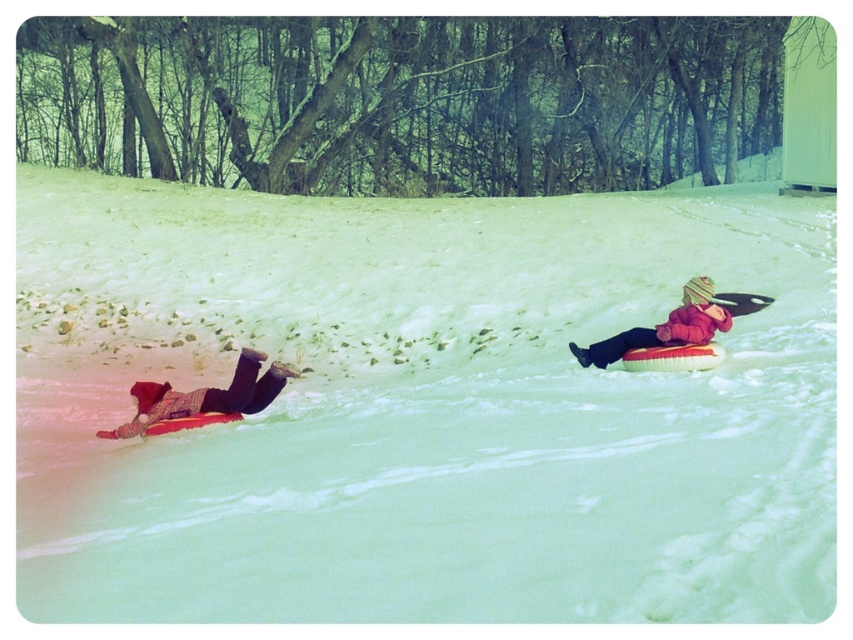
Question: Is the position of white fluffy snow at center more distant than that of red fuzzy winter hat at upper right?

Choices:
 (A) no
 (B) yes

Answer: (A)

Question: Can you confirm if plaid fabric snowsuit at lower left is positioned to the left of red fuzzy winter hat at upper right?

Choices:
 (A) yes
 (B) no

Answer: (A)

Question: Among these points, which one is farthest from the camera?

Choices:
 (A) (689, 330)
 (B) (289, 365)

Answer: (B)

Question: Which of the following is the closest to the observer?

Choices:
 (A) plaid fabric snowsuit at lower left
 (B) red fuzzy winter hat at upper right

Answer: (A)

Question: Can you confirm if white fluffy snow at center is positioned below red fuzzy winter hat at upper right?

Choices:
 (A) yes
 (B) no

Answer: (B)

Question: Which of these objects is positioned farthest from the red fuzzy winter hat at upper right?

Choices:
 (A) plaid fabric snowsuit at lower left
 (B) white fluffy snow at center

Answer: (A)